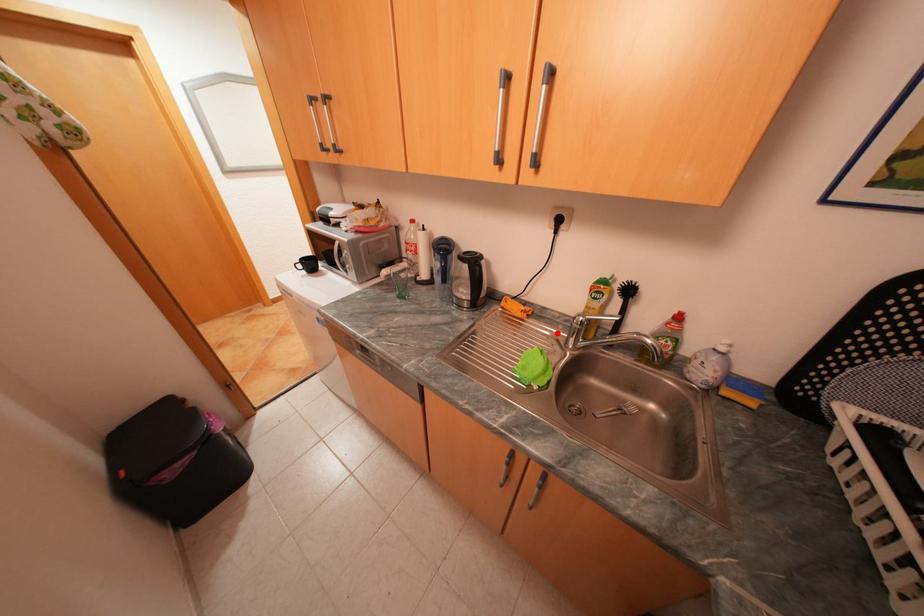
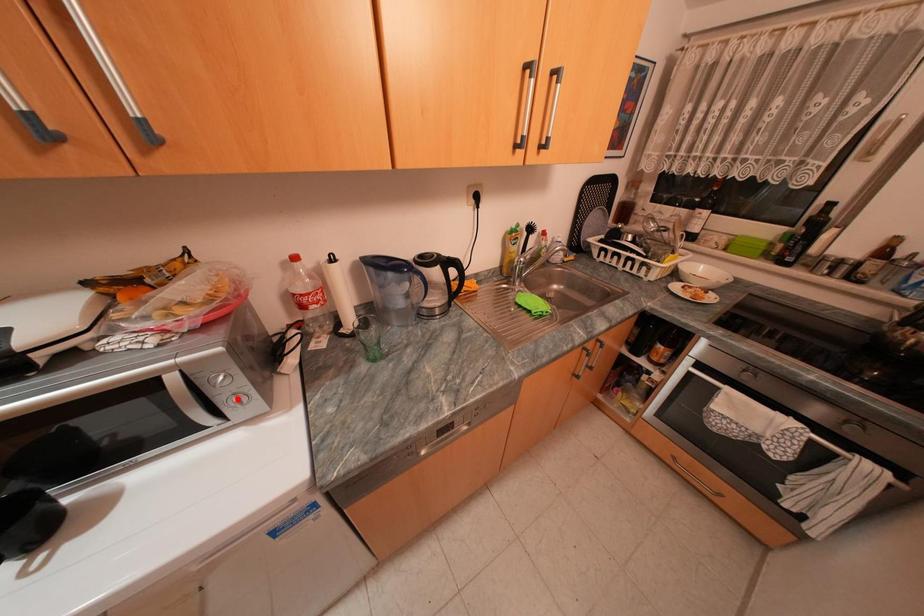
I am providing you with two images of the same scene from different viewpoints. A red point is marked on the first image and another point is marked on the second image. Do the highlighted points in image1 and image2 indicate the same real-world spot?

No